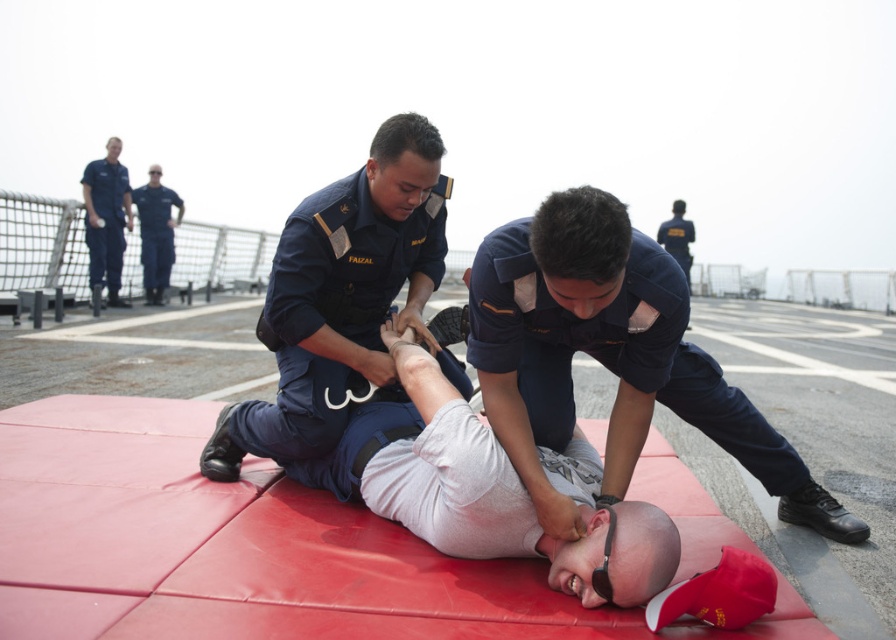
You are a photographer positioned at the front of the deck. You need to capture a clear photo of both the navy blue uniform at center and the blue uniform at upper left. Which one will appear larger in the photo?

The navy blue uniform at center will appear larger in the photo because it is closer to the viewer than the blue uniform at upper left.